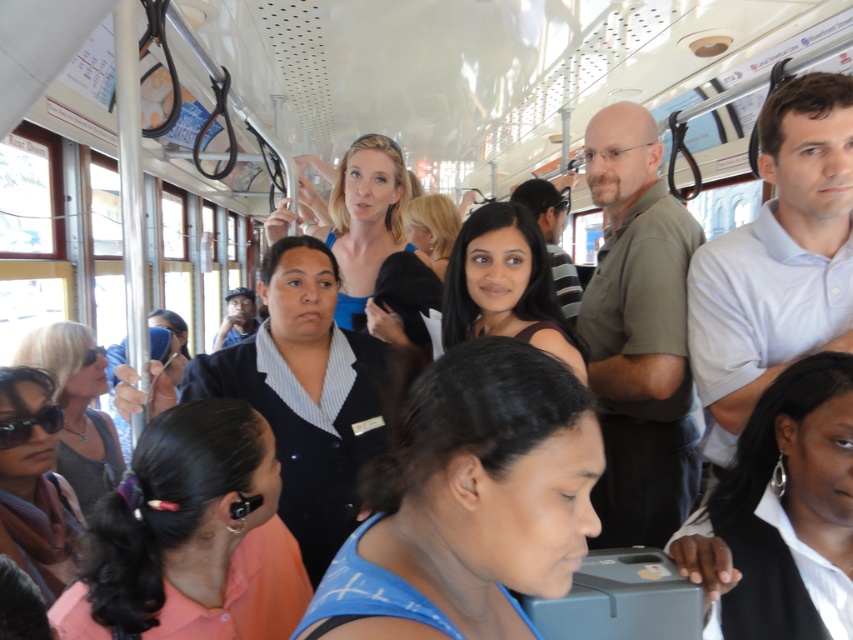
You are standing inside a public transportation vehicle and want to reach a point marked at coordinates point (x=149, y=500). If you are currently 1.07 meters away from this point, can you safely step forward to reach it without moving any other passengers?

The distance between you and the point (x=149, y=500) is 1.07 meters. Since there are no other passengers mentioned in the way, you can safely step forward to reach it.